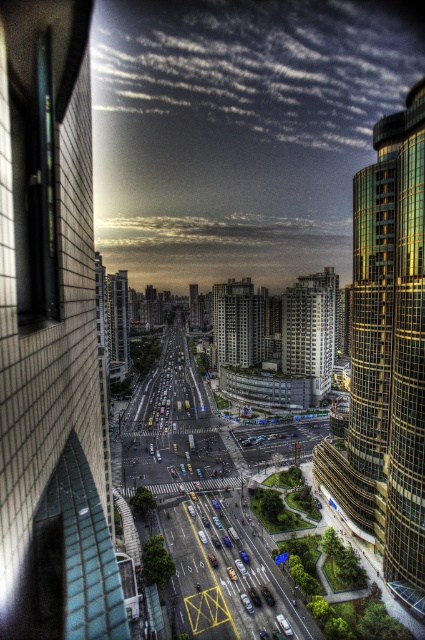
You are a drone operator trying to deliver a package to the shiny glass skyscraper at right and the dark gray concrete building at center. Which building should you aim for first if you want to reach the closer one?

The shiny glass skyscraper at right is closer to the viewer than the dark gray concrete building at center, so you should aim for the shiny glass skyscraper at right first.

In the scene shown: You are standing at the center of the road in the image. Looking towards the left side of the road, which object is located at coordinate point (x=51, y=337)?

The point (x=51, y=337) corresponds to the brick wall at left.

You are a city planner analyzing the urban layout. Given the scene described, which of the two buildings, the dark gray concrete building at center or the white concrete building at center, would cast a longer shadow at noon? Please base your answer solely on the information provided.

The white concrete building at center is taller than the dark gray concrete building at center. Since taller buildings cast longer shadows, the white concrete building at center would cast a longer shadow at noon.